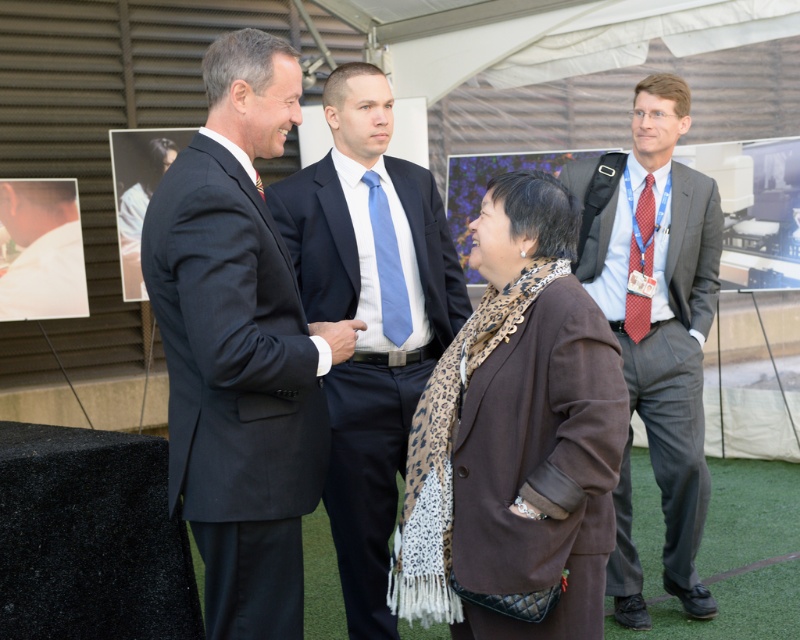
Question: Does blue satin tie at center appear on the right side of light blue silk tie at center?

Choices:
 (A) no
 (B) yes

Answer: (A)

Question: Does matte black suit at center have a greater width compared to red dotted tie at right?

Choices:
 (A) no
 (B) yes

Answer: (B)

Question: Among these objects, which one is farthest from the camera?

Choices:
 (A) red dotted tie at right
 (B) brown woolen coat at center

Answer: (A)

Question: Can you confirm if matte black suit at center is wider than blue satin tie at center?

Choices:
 (A) no
 (B) yes

Answer: (A)

Question: Which point is closer to the camera?

Choices:
 (A) click(396, 240)
 (B) click(280, 68)

Answer: (B)

Question: Which object appears farthest from the camera in this image?

Choices:
 (A) matte gray suit at right
 (B) red dotted tie at right

Answer: (B)